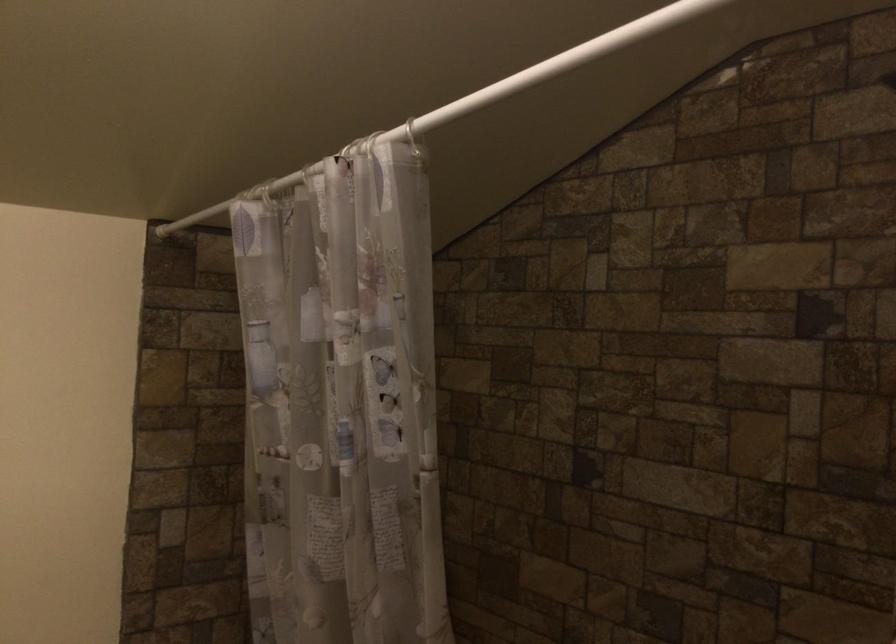
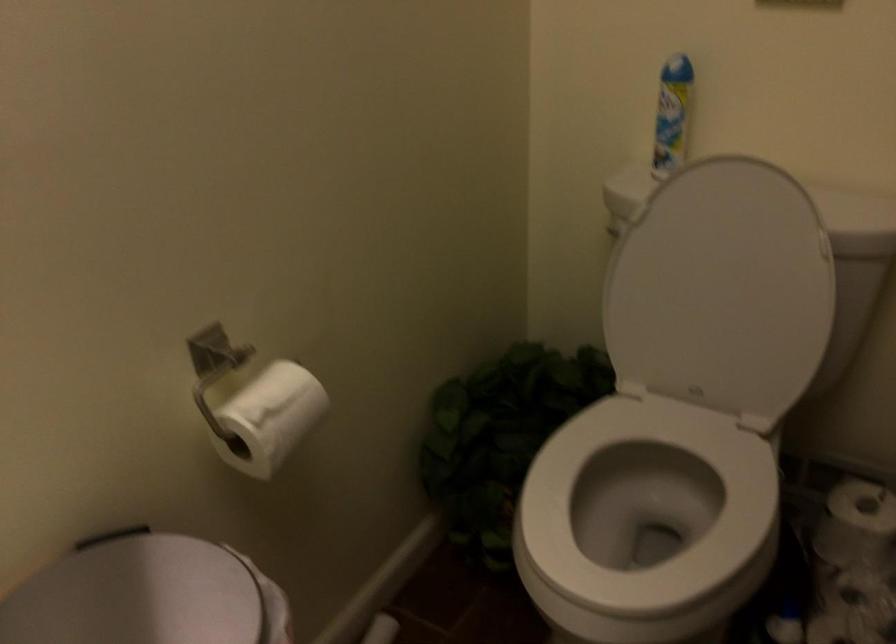
Based on the continuous images, in which direction is the camera rotating?

The rotation direction of the camera is left-down.